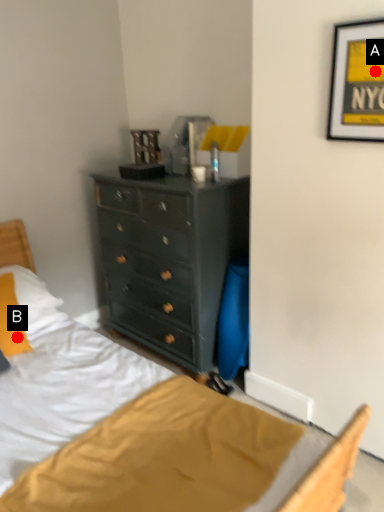
Question: Two points are circled on the image, labeled by A and B beside each circle. Which point appears farthest from the camera in this image?

Choices:
 (A) A is further
 (B) B is further

Answer: (B)